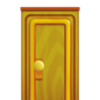
The image size is (100, 100). I want to click on door, so click(x=50, y=80).